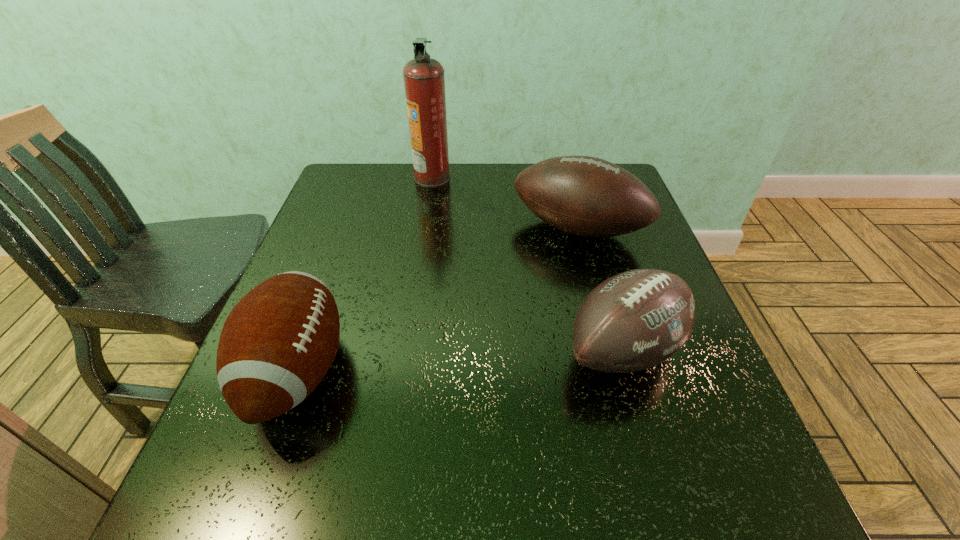
Find the location of `object that ranks as the third closest to the leftmost football (American)`. object that ranks as the third closest to the leftmost football (American) is located at coordinates (424, 81).

Where is `the closest object to the leftmost football (American)`? This screenshot has width=960, height=540. the closest object to the leftmost football (American) is located at coordinates (586, 196).

Locate which football (American) ranks in proximity to the leftmost object. Please provide its 2D coordinates. Your answer should be formatted as a tuple, i.e. [(x, y)], where the tuple contains the x and y coordinates of a point satisfying the conditions above.

[(586, 196)]

Find the location of `the closest football (American) to the leftmost object`. the closest football (American) to the leftmost object is located at coordinates (586, 196).

The width and height of the screenshot is (960, 540). I want to click on vacant area in the image that satisfies the following two spatial constraints: 1. on the back side of the farthest football (American); 2. at the nozzle of the tallest object, so click(x=564, y=178).